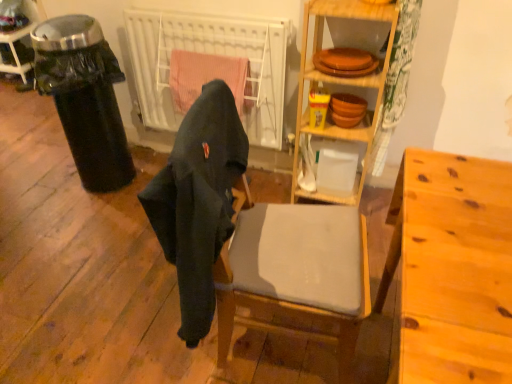
You are a GUI agent. You are given a task and a screenshot of the screen. Output one action in this format:
    pyautogui.click(x=<x>, y=<y>)
    Task: Click on the free spot above white matte radiator at center (from a real-world perspective)
    
    Given the screenshot: What is the action you would take?
    pyautogui.click(x=185, y=8)